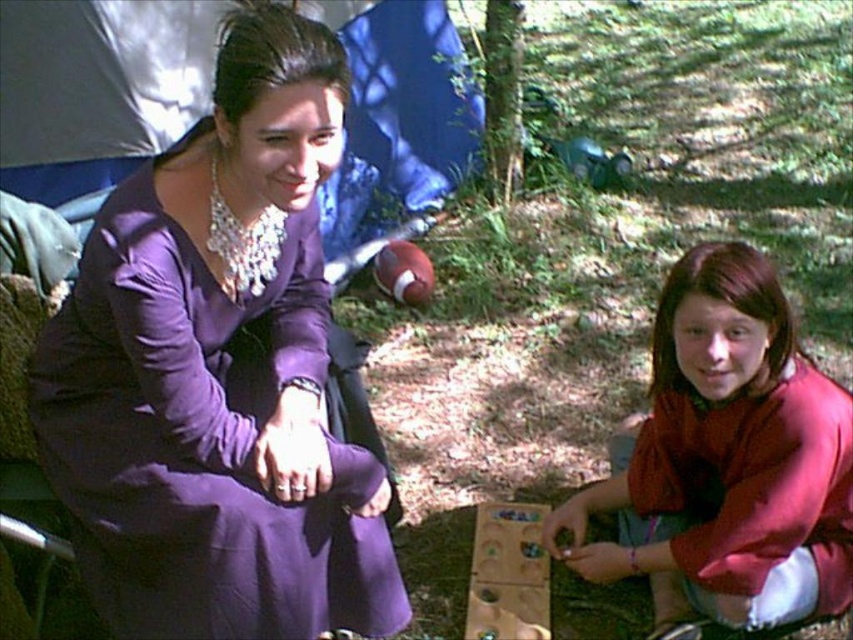
Is point (247, 465) closer to camera compared to point (764, 580)?

Yes, point (247, 465) is in front of point (764, 580).

Between purple satin dress at center and matte red sweater at lower right, which one is positioned higher?

Positioned higher is purple satin dress at center.

What do you see at coordinates (218, 372) in the screenshot? I see `purple satin dress at center` at bounding box center [218, 372].

At what (x,y) coordinates should I click in order to perform the action: click on purple satin dress at center. Please return your answer as a coordinate pair (x, y). Looking at the image, I should click on (218, 372).